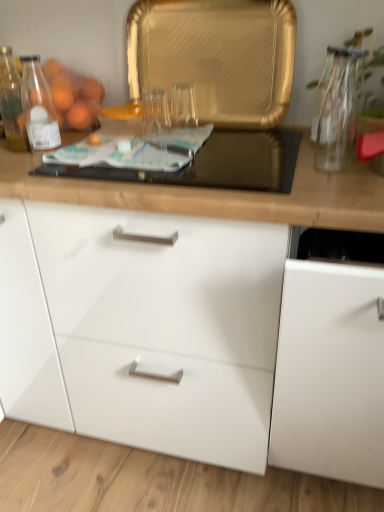
The height and width of the screenshot is (512, 384). What are the coordinates of `translucent glass bottle at left` in the screenshot? It's located at (38, 106).

This screenshot has height=512, width=384. What do you see at coordinates (38, 106) in the screenshot?
I see `translucent glass bottle at left` at bounding box center [38, 106].

From the picture: Measure the distance between white glossy cabinet at center, which is the 1th cabinetry from left to right, and camera.

white glossy cabinet at center, which is the 1th cabinetry from left to right, is 26.93 inches from camera.

Measure the distance between transparent glass vase at right and camera.

The distance of transparent glass vase at right from camera is 1.08 meters.

Find the location of a particular element. black glass gas stove at center is located at coordinates (214, 164).

Looking at this image, from the image's perspective, would you say translucent glass bottle at left is shown under orange matte plastic bag at upper left?

Incorrect, from the image's perspective, translucent glass bottle at left is higher than orange matte plastic bag at upper left.

Where is `bottle above the orange matte plastic bag at upper left (from the image's perspective)`? The width and height of the screenshot is (384, 512). bottle above the orange matte plastic bag at upper left (from the image's perspective) is located at coordinates (38, 106).

Is translucent glass bottle at left closer to the viewer compared to orange matte plastic bag at upper left?

No, it is behind orange matte plastic bag at upper left.

Who is bigger, translucent glass bottle at left or orange matte plastic bag at upper left?

Bigger between the two is orange matte plastic bag at upper left.

What's the angular difference between white glossy cabinet at center, positioned as the 2th cabinetry in right-to-left order, and translucent glass bottle at left's facing directions?

The angular difference between white glossy cabinet at center, positioned as the 2th cabinetry in right-to-left order, and translucent glass bottle at left is 0.386 degrees.

Is white glossy cabinet at center, positioned as the 2th cabinetry in right-to-left order, looking in the opposite direction of translucent glass bottle at left?

No, white glossy cabinet at center, positioned as the 2th cabinetry in right-to-left order, is not facing away from translucent glass bottle at left.

Is white glossy cabinet at center, which is the 1th cabinetry from left to right, positioned far away from translucent glass bottle at left?

white glossy cabinet at center, which is the 1th cabinetry from left to right, is actually quite close to translucent glass bottle at left.

Can you confirm if white glossy cabinet at center, positioned as the 2th cabinetry in right-to-left order, is shorter than translucent glass bottle at left?

No.

Is white glossy cabinet at right, the 1th cabinetry viewed from the right, facing away from orange matte plastic bag at upper left?

No, white glossy cabinet at right, the 1th cabinetry viewed from the right, is not facing the opposite direction of orange matte plastic bag at upper left.

From the image's perspective, is white glossy cabinet at right, which is the 2th cabinetry in left-to-right order, located above orange matte plastic bag at upper left?

No, from the image's perspective, white glossy cabinet at right, which is the 2th cabinetry in left-to-right order, is not over orange matte plastic bag at upper left.

Is white glossy cabinet at right, the 1th cabinetry viewed from the right, inside or outside of orange matte plastic bag at upper left?

white glossy cabinet at right, the 1th cabinetry viewed from the right, cannot be found inside orange matte plastic bag at upper left.

How different are the orientations of white glossy cabinet at right, the 1th cabinetry viewed from the right, and orange matte plastic bag at upper left in degrees?

The angular difference between white glossy cabinet at right, the 1th cabinetry viewed from the right, and orange matte plastic bag at upper left is 0.0209 degrees.

The image size is (384, 512). I want to click on bottle above the orange matte plastic bag at upper left (from the image's perspective), so click(38, 106).

Relative to translucent glass bottle at left, is orange matte plastic bag at upper left in front or behind?

Clearly, orange matte plastic bag at upper left is in front of translucent glass bottle at left.

Between orange matte plastic bag at upper left and translucent glass bottle at left, which one has more height?

With more height is translucent glass bottle at left.

Could you measure the distance between orange matte plastic bag at upper left and white glossy cabinet at right, which is the 2th cabinetry in left-to-right order?

The distance of orange matte plastic bag at upper left from white glossy cabinet at right, which is the 2th cabinetry in left-to-right order, is 97.05 centimeters.

Between orange matte plastic bag at upper left and white glossy cabinet at right, which is the 2th cabinetry in left-to-right order, which one has less height?

With less height is orange matte plastic bag at upper left.

Is orange matte plastic bag at upper left far away from white glossy cabinet at right, the 1th cabinetry viewed from the right?

No, orange matte plastic bag at upper left is not far from white glossy cabinet at right, the 1th cabinetry viewed from the right.

Does point (72, 119) come in front of point (320, 449)?

No.

Is black glass gas stove at center bigger than white glossy cabinet at right, which is the 2th cabinetry in left-to-right order?

No.

Which object is thinner, black glass gas stove at center or white glossy cabinet at right, which is the 2th cabinetry in left-to-right order?

Thinner between the two is black glass gas stove at center.

From a real-world perspective, is black glass gas stove at center physically located above or below white glossy cabinet at right, which is the 2th cabinetry in left-to-right order?

Clearly, from a real-world perspective, black glass gas stove at center is above white glossy cabinet at right, which is the 2th cabinetry in left-to-right order.

Is the surface of black glass gas stove at center in direct contact with white glossy cabinet at right, which is the 2th cabinetry in left-to-right order?

black glass gas stove at center is not next to white glossy cabinet at right, which is the 2th cabinetry in left-to-right order, and they're not touching.

From a real-world perspective, is white glossy cabinet at right, which is the 2th cabinetry in left-to-right order, beneath transparent glass vase at upper right?

Yes, from a real-world perspective, white glossy cabinet at right, which is the 2th cabinetry in left-to-right order, is beneath transparent glass vase at upper right.

Could you tell me if white glossy cabinet at right, the 1th cabinetry viewed from the right, is turned towards transparent glass vase at upper right?

No.

At what (x,y) coordinates should I click in order to perform the action: click on glass vase that is above the white glossy cabinet at right, which is the 2th cabinetry in left-to-right order (from the image's perspective). Please return your answer as a coordinate pair (x, y). Looking at the image, I should click on (336, 109).

Locate an element on the screen. This screenshot has width=384, height=512. bottle that appears above the orange matte plastic bag at upper left (from the image's perspective) is located at coordinates point(38,106).

You are a GUI agent. You are given a task and a screenshot of the screen. Output one action in this format:
    pyautogui.click(x=<x>, y=<y>)
    Task: Click on the 2nd cabinetry positioned below the translucent glass bottle at left (from a real-world perspective)
    This screenshot has width=384, height=512.
    Given the screenshot: What is the action you would take?
    tap(172, 339)

Considering their positions, is orange matte plastic bag at upper left positioned further to black glass gas stove at center than translucent glass bottle at left?

Among the two, orange matte plastic bag at upper left is located further to black glass gas stove at center.

Which object lies nearer to the anchor point white glossy cabinet at center, positioned as the 2th cabinetry in right-to-left order, orange matte plastic bag at upper left or transparent glass vase at right?

Based on the image, orange matte plastic bag at upper left appears to be nearer to white glossy cabinet at center, positioned as the 2th cabinetry in right-to-left order.

From the image, which object appears to be farther from black glass gas stove at center, transparent glass vase at upper right or orange matte plastic bag at upper left?

orange matte plastic bag at upper left.

Looking at the image, which one is located closer to orange matte plastic bag at upper left, white glossy cabinet at center, which is the 1th cabinetry from left to right, or white glossy cabinet at right, the 1th cabinetry viewed from the right?

Based on the image, white glossy cabinet at center, which is the 1th cabinetry from left to right, appears to be nearer to orange matte plastic bag at upper left.

Considering their positions, is translucent glass bottle at left positioned closer to orange matte plastic bag at upper left than white glossy cabinet at right, which is the 2th cabinetry in left-to-right order?

The object closer to orange matte plastic bag at upper left is translucent glass bottle at left.

Consider the image. Considering their positions, is transparent glass vase at right positioned closer to white glossy cabinet at center, which is the 1th cabinetry from left to right, than white glossy cabinet at right, which is the 2th cabinetry in left-to-right order?

white glossy cabinet at right, which is the 2th cabinetry in left-to-right order, lies closer to white glossy cabinet at center, which is the 1th cabinetry from left to right, than the other object.

Which object lies nearer to the anchor point white glossy cabinet at right, which is the 2th cabinetry in left-to-right order, transparent glass vase at upper right or transparent glass vase at right?

transparent glass vase at upper right is closer to white glossy cabinet at right, which is the 2th cabinetry in left-to-right order.

Based on their spatial positions, is white glossy cabinet at center, which is the 1th cabinetry from left to right, or transparent glass vase at upper right closer to black glass gas stove at center?

transparent glass vase at upper right lies closer to black glass gas stove at center than the other object.

Locate an element on the screen. This screenshot has width=384, height=512. plant situated between translucent glass bottle at left and white glossy cabinet at right, the 1th cabinetry viewed from the right, from left to right is located at coordinates (367, 51).

The height and width of the screenshot is (512, 384). What are the coordinates of `fruit between translucent glass bottle at left and black glass gas stove at center` in the screenshot? It's located at (74, 96).

The image size is (384, 512). Find the location of `glass vase between black glass gas stove at center and transparent glass vase at right from left to right`. glass vase between black glass gas stove at center and transparent glass vase at right from left to right is located at coordinates (336, 109).

Locate an element on the screen. The height and width of the screenshot is (512, 384). gas stove between transparent glass vase at right and white glossy cabinet at right, which is the 2th cabinetry in left-to-right order, in the vertical direction is located at coordinates (214, 164).